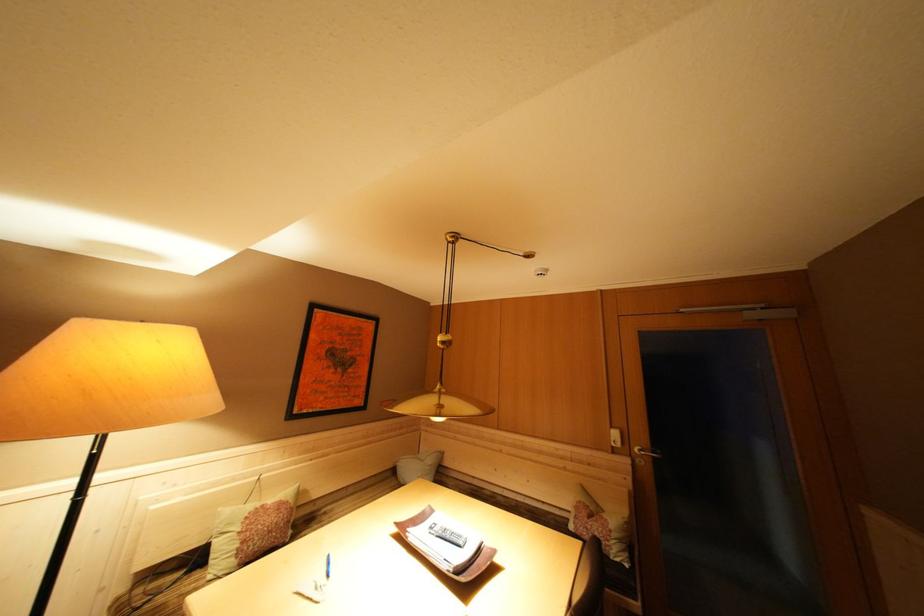
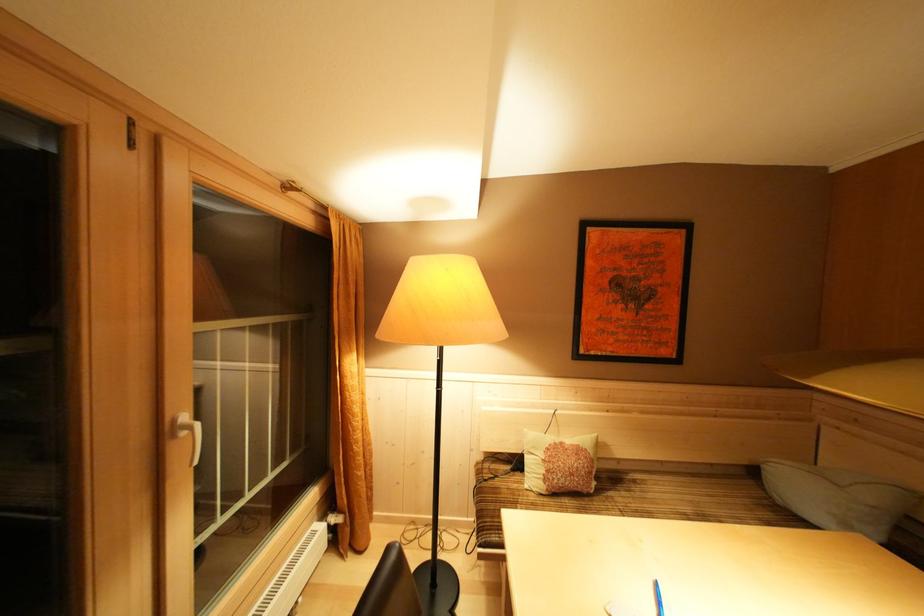
Find the pixel in the second image that matches point 438,466 in the first image.

(879, 503)